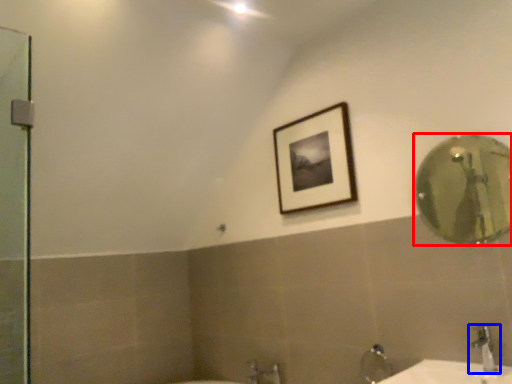
Question: Among these objects, which one is farthest to the camera, mirror (highlighted by a red box) or tap (highlighted by a blue box)?

Choices:
 (A) mirror
 (B) tap

Answer: (A)